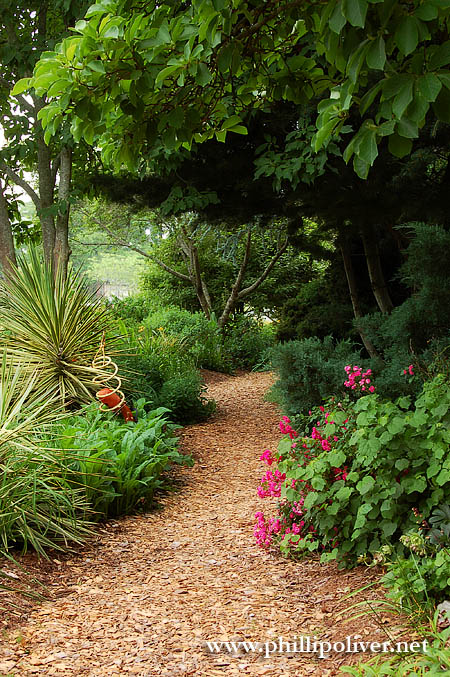
This screenshot has height=677, width=450. Identify the location of plant on the bottom right. (441, 663).